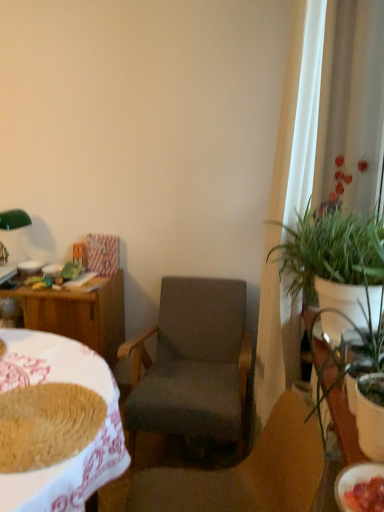
Question: Is the depth of dark gray fabric chair at center, which ranks as the 2th chair in front-to-back order, less than that of matte white bowl at lower right, which is the first bowl from right to left?

Choices:
 (A) yes
 (B) no

Answer: (B)

Question: From the image's perspective, would you say dark gray fabric chair at center, placed as the 1th chair when sorted from back to front, is positioned over matte white bowl at lower right, the first bowl ordered from the bottom?

Choices:
 (A) yes
 (B) no

Answer: (B)

Question: From a real-world perspective, is dark gray fabric chair at center, placed as the 1th chair when sorted from back to front, over matte white bowl at lower right, the second bowl positioned from the back?

Choices:
 (A) no
 (B) yes

Answer: (A)

Question: Considering the relative sizes of dark gray fabric chair at center, placed as the 1th chair when sorted from back to front, and matte white bowl at lower right, which is the first bowl from right to left, in the image provided, is dark gray fabric chair at center, placed as the 1th chair when sorted from back to front, wider than matte white bowl at lower right, which is the first bowl from right to left,?

Choices:
 (A) yes
 (B) no

Answer: (A)

Question: Is green leafy plant at right wider or thinner than wooden table at left, which is counted as the 1th table, starting from the back?

Choices:
 (A) thin
 (B) wide

Answer: (A)

Question: Is green leafy plant at right in front of or behind wooden table at left, the second table positioned from the front, in the image?

Choices:
 (A) behind
 (B) front

Answer: (B)

Question: Considering the positions of point tap(304, 271) and point tap(66, 325), is point tap(304, 271) closer or farther from the camera than point tap(66, 325)?

Choices:
 (A) farther
 (B) closer

Answer: (B)

Question: Would you say green leafy plant at right is inside or outside wooden table at left, arranged as the second table when viewed from the right?

Choices:
 (A) inside
 (B) outside

Answer: (B)

Question: Looking at their shapes, would you say white glossy bowl at left, which is counted as the first bowl, starting from the top, is wider or thinner than baked brown bread at lower left?

Choices:
 (A) thin
 (B) wide

Answer: (A)

Question: From a real-world perspective, is white glossy bowl at left, which appears as the 1th bowl when viewed from the back, positioned above or below baked brown bread at lower left?

Choices:
 (A) below
 (B) above

Answer: (A)

Question: Looking at the image, does white glossy bowl at left, which is the second bowl from front to back, seem bigger or smaller compared to baked brown bread at lower left?

Choices:
 (A) big
 (B) small

Answer: (B)

Question: Is white glossy bowl at left, which is counted as the first bowl, starting from the top, to the left or to the right of baked brown bread at lower left in the image?

Choices:
 (A) right
 (B) left

Answer: (B)

Question: From their relative heights in the image, would you say white glossy bowl at left, which is counted as the first bowl, starting from the top, is taller or shorter than white sheer curtain at right?

Choices:
 (A) short
 (B) tall

Answer: (A)

Question: From a real-world perspective, is white glossy bowl at left, the 1th bowl viewed from the left, physically located above or below white sheer curtain at right?

Choices:
 (A) above
 (B) below

Answer: (B)